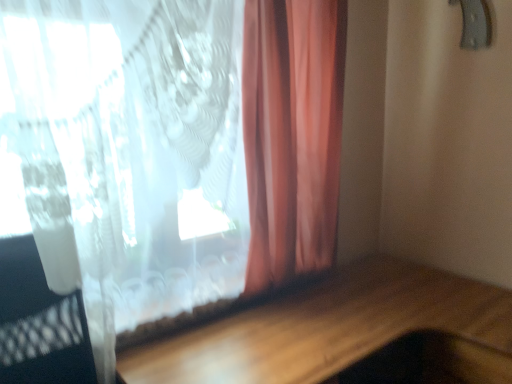
Find the location of a particular element. The width and height of the screenshot is (512, 384). vacant area situated below translucent fabric curtain at upper left (from a real-world perspective) is located at coordinates (198, 327).